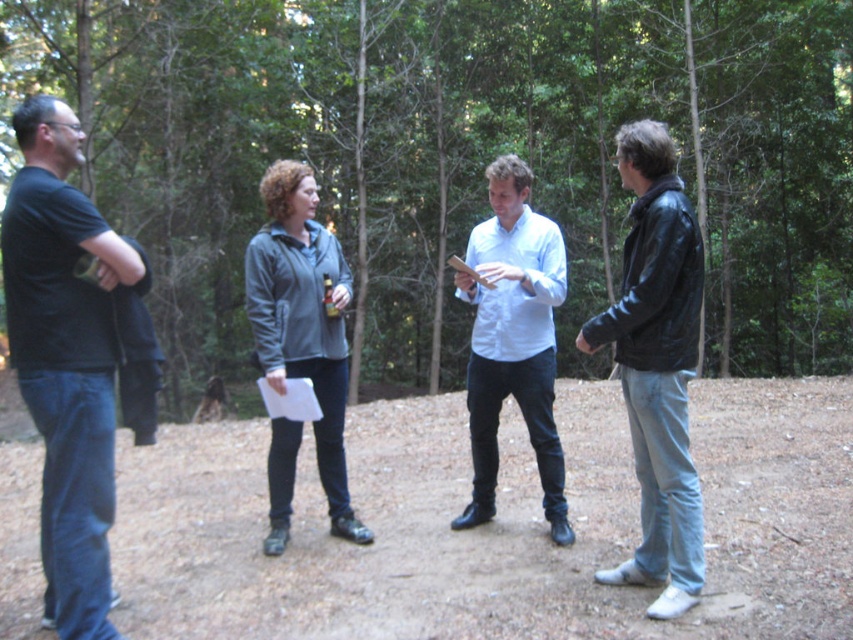
Question: Estimate the real-world distances between objects in this image. Which object is closer to the brown dirt ground at center?

Choices:
 (A) light blue shirt at center
 (B) black leather jacket at right
 (C) black matte t-shirt at left

Answer: (C)

Question: Does black matte t-shirt at left have a smaller size compared to light blue shirt at center?

Choices:
 (A) no
 (B) yes

Answer: (A)

Question: Does brown dirt ground at center appear on the left side of black matte t-shirt at left?

Choices:
 (A) no
 (B) yes

Answer: (A)

Question: Which point is closer to the camera?

Choices:
 (A) brown dirt ground at center
 (B) black matte t-shirt at left

Answer: (B)

Question: Does brown dirt ground at center appear on the right side of light blue shirt at center?

Choices:
 (A) no
 (B) yes

Answer: (B)

Question: Which point is closer to the camera?

Choices:
 (A) (519, 259)
 (B) (699, 548)

Answer: (B)